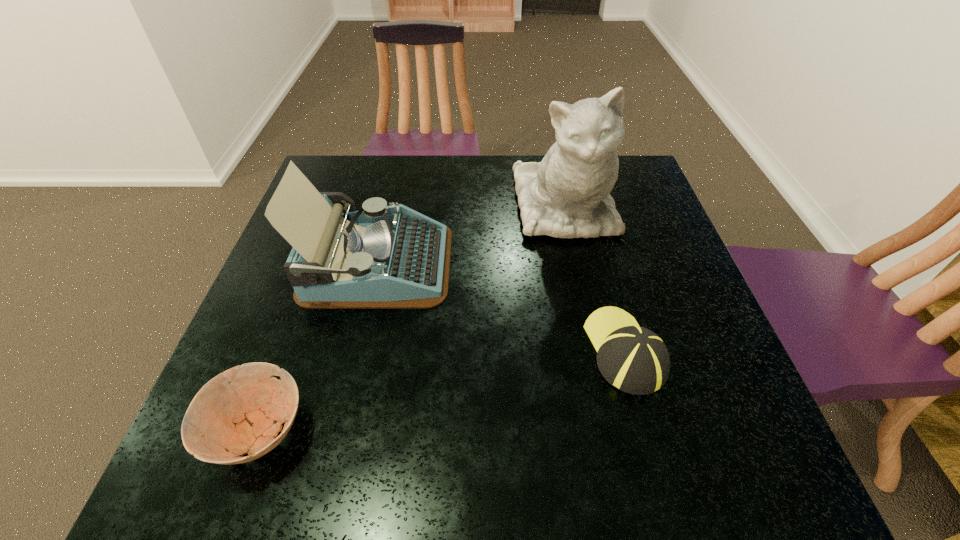
What are the coordinates of `object positioned at the far edge` in the screenshot? It's located at (567, 194).

You are a GUI agent. You are given a task and a screenshot of the screen. Output one action in this format:
    pyautogui.click(x=<x>, y=<y>)
    Task: Click on the object situated at the near edge
    
    Given the screenshot: What is the action you would take?
    pyautogui.click(x=236, y=411)

Identify the location of typewriter present at the left edge. The image size is (960, 540). (381, 257).

This screenshot has height=540, width=960. I want to click on bowl located at the left edge, so click(x=236, y=411).

Find the location of a particular element. The image size is (960, 540). cat situated at the right edge is located at coordinates (567, 194).

This screenshot has height=540, width=960. I want to click on baseball cap at the right edge, so click(x=634, y=359).

You are a GUI agent. You are given a task and a screenshot of the screen. Output one action in this format:
    pyautogui.click(x=<x>, y=<y>)
    Task: Click on the object that is at the near left corner
    This screenshot has height=540, width=960.
    Given the screenshot: What is the action you would take?
    pyautogui.click(x=236, y=411)

The height and width of the screenshot is (540, 960). Find the location of `object that is positioned at the far right corner`. object that is positioned at the far right corner is located at coordinates (567, 194).

Find the location of `vacant space at the far edge of the desktop`. vacant space at the far edge of the desktop is located at coordinates (478, 177).

In order to click on vacant space at the left edge of the desktop in this screenshot , I will do `click(284, 313)`.